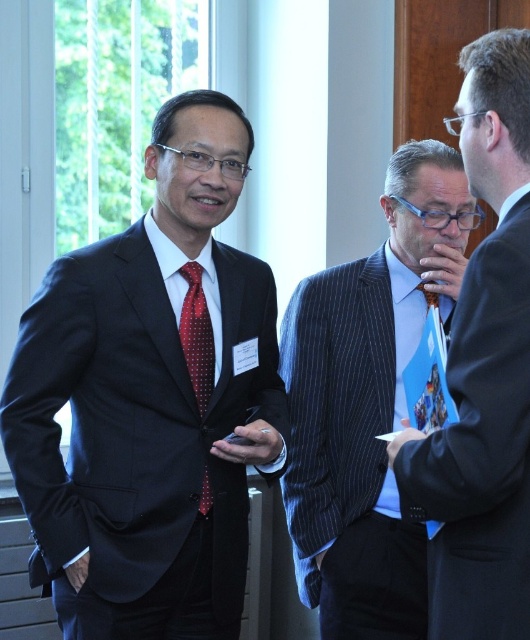
In the scene shown: You are standing in the room where the three men are talking. You want to find the point at coordinate [151,400]. Which object is this point located on?

The point at coordinate [151,400] is located on the matte black suit at left.

You are a photographer at a formal event and need to position a spotlight at the point labeled point (151,400). Which object in the scene should you direct the spotlight towards?

The point (151,400) corresponds to the matte black suit at left, so you should direct the spotlight towards the matte black suit at left.